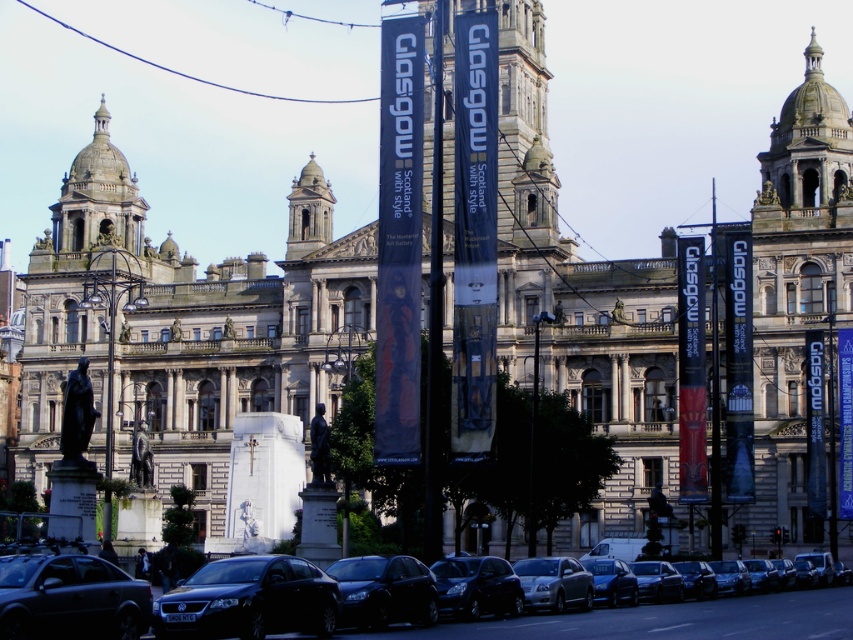
Can you confirm if black glossy car at lower center is shorter than shiny black car at center?

No, black glossy car at lower center is not shorter than shiny black car at center.

Is point (842, 628) positioned after point (418, 611)?

No, (842, 628) is in front of (418, 611).

Find the location of a particular element. The height and width of the screenshot is (640, 853). black glossy car at lower center is located at coordinates (660, 620).

Who is lower down, shiny black sedan at lower center or silver metallic sedan at center?

Positioned lower is shiny black sedan at lower center.

Between shiny black sedan at lower center and silver metallic sedan at center, which one appears on the right side from the viewer's perspective?

Positioned to the right is silver metallic sedan at center.

I want to click on shiny black sedan at lower center, so click(248, 600).

Is shiny black car at center above silver metallic sedan at center?

Correct, shiny black car at center is located above silver metallic sedan at center.

Does shiny black car at center have a greater width compared to silver metallic sedan at center?

Correct, the width of shiny black car at center exceeds that of silver metallic sedan at center.

The width and height of the screenshot is (853, 640). What do you see at coordinates (384, 589) in the screenshot?
I see `shiny black car at center` at bounding box center [384, 589].

The width and height of the screenshot is (853, 640). Find the location of `shiny black car at center`. shiny black car at center is located at coordinates (384, 589).